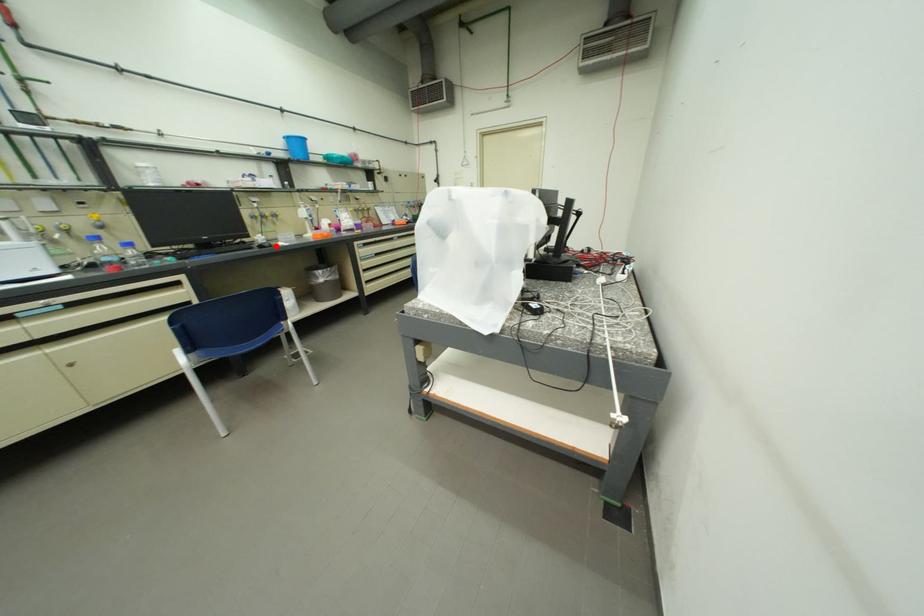
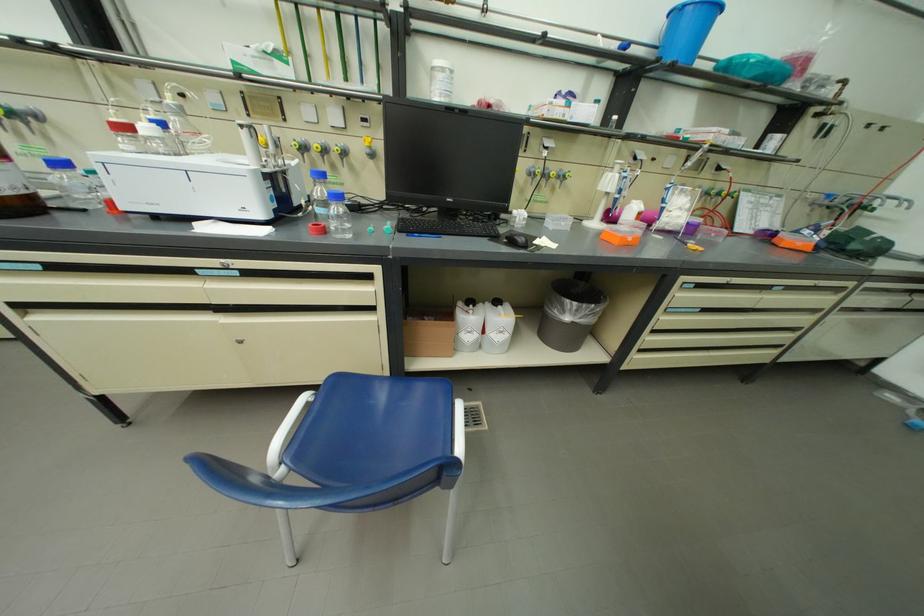
Locate, in the second image, the point that corresponds to the highlighted location in the first image.

(530, 241)